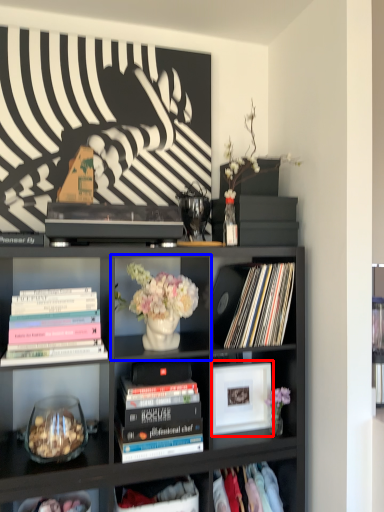
Question: Which point is further to the camera, picture frame (highlighted by a red box) or shelf (highlighted by a blue box)?

Choices:
 (A) picture frame
 (B) shelf

Answer: (A)